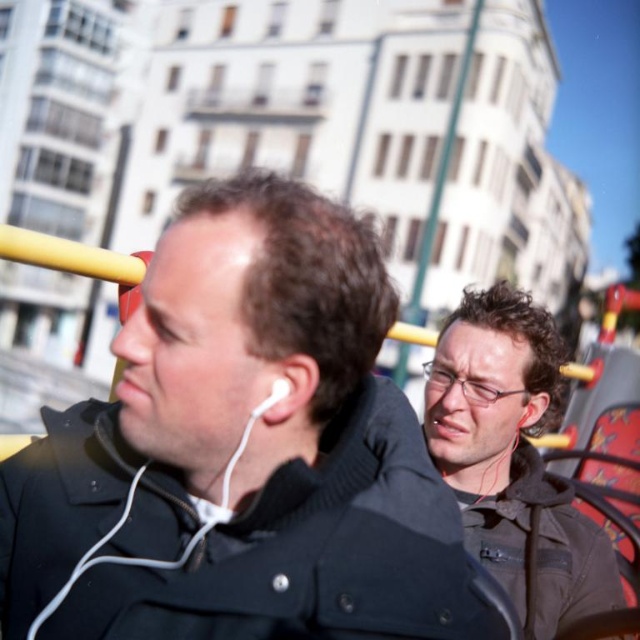
You are a photographer trying to capture a candid shot of the person wearing the black matte jacket at center. You notice a point marked at coordinates (243, 452). Where exactly on the black matte jacket at center is this point located?

The point at coordinates (243, 452) is located on the black matte jacket at center.

You are a fashion designer observing the scene. You need to determine if the matte black jacket at center can be paired with the white earbud at left based on their sizes. Can the jacket accommodate the earbud without any issues?

The matte black jacket at center is bigger than the white earbud at left, so yes, the jacket can accommodate the earbud without any issues.